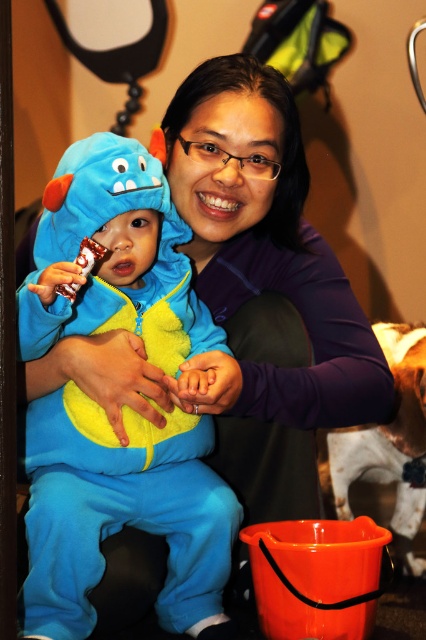
This screenshot has height=640, width=426. I want to click on fuzzy blue onesie at left, so click(121, 515).